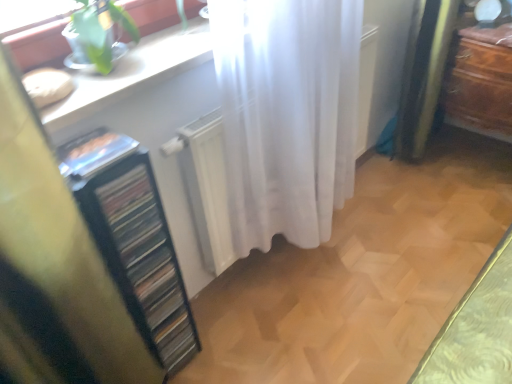
What do you see at coordinates (133, 73) in the screenshot? I see `white glossy counter top at upper left` at bounding box center [133, 73].

The image size is (512, 384). What do you see at coordinates (287, 114) in the screenshot?
I see `white sheer curtain at center` at bounding box center [287, 114].

Image resolution: width=512 pixels, height=384 pixels. Describe the element at coordinates (482, 82) in the screenshot. I see `brown wooden dresser at right` at that location.

The height and width of the screenshot is (384, 512). I want to click on black plastic file cabinet at left, so click(x=133, y=239).

Could you tell me if white sheer curtain at center is facing black plastic file cabinet at left?

No, white sheer curtain at center is not facing towards black plastic file cabinet at left.

Does white sheer curtain at center appear on the right side of black plastic file cabinet at left?

Indeed, white sheer curtain at center is positioned on the right side of black plastic file cabinet at left.

Does white sheer curtain at center have a lesser height compared to black plastic file cabinet at left?

Correct, white sheer curtain at center is not as tall as black plastic file cabinet at left.

Is the position of white sheer curtain at center less distant than that of black plastic file cabinet at left?

No, white sheer curtain at center is behind black plastic file cabinet at left.

Is white sheer curtain at center aimed at white glossy counter top at upper left?

No, white sheer curtain at center is not facing towards white glossy counter top at upper left.

This screenshot has height=384, width=512. What are the coordinates of `counter top above the white sheer curtain at center (from a real-world perspective)` in the screenshot? It's located at (133, 73).

Is point (294, 228) positioned in front of point (136, 83)?

No.

What's the angular difference between white sheer curtain at center and white glossy counter top at upper left's facing directions?

The angular difference between white sheer curtain at center and white glossy counter top at upper left is 0.134 degrees.

From a real-world perspective, which object rests below the other?

brown wooden dresser at right, from a real-world perspective.

Considering the relative sizes of brown wooden dresser at right and black plastic file cabinet at left in the image provided, is brown wooden dresser at right wider than black plastic file cabinet at left?

Indeed, brown wooden dresser at right has a greater width compared to black plastic file cabinet at left.

Based on the photo, from the image's perspective, which is above, brown wooden dresser at right or black plastic file cabinet at left?

brown wooden dresser at right.

Is brown wooden dresser at right facing towards black plastic file cabinet at left?

Yes, brown wooden dresser at right is oriented towards black plastic file cabinet at left.

Does black plastic file cabinet at left have a smaller size compared to white sheer curtain at center?

Indeed, black plastic file cabinet at left has a smaller size compared to white sheer curtain at center.

Considering the relative sizes of black plastic file cabinet at left and white sheer curtain at center in the image provided, is black plastic file cabinet at left shorter than white sheer curtain at center?

In fact, black plastic file cabinet at left may be taller than white sheer curtain at center.

Considering the positions of points (133, 152) and (351, 98), is point (133, 152) closer to camera compared to point (351, 98)?

Yes, point (133, 152) is in front of point (351, 98).

Is black plastic file cabinet at left directly adjacent to white sheer curtain at center?

No, black plastic file cabinet at left is not with white sheer curtain at center.

Is brown wooden dresser at right spatially inside white sheer curtain at center, or outside of it?

brown wooden dresser at right is spatially situated outside white sheer curtain at center.

Is brown wooden dresser at right not close to white sheer curtain at center?

brown wooden dresser at right is actually quite close to white sheer curtain at center.

Find the location of a particular element. furniture lying on the right of white sheer curtain at center is located at coordinates (482, 82).

Can you confirm if brown wooden dresser at right is taller than white sheer curtain at center?

Yes.

From the picture: Considering their positions, is white glossy counter top at upper left located in front of or behind white sheer curtain at center?

Visually, white glossy counter top at upper left is located in front of white sheer curtain at center.

Looking at their sizes, would you say white glossy counter top at upper left is wider or thinner than white sheer curtain at center?

Clearly, white glossy counter top at upper left has more width compared to white sheer curtain at center.

Can we say white glossy counter top at upper left lies outside white sheer curtain at center?

white glossy counter top at upper left is positioned outside white sheer curtain at center.

Is white glossy counter top at upper left facing away from white sheer curtain at center?

white glossy counter top at upper left is not turned away from white sheer curtain at center.

From the image's perspective, is white glossy counter top at upper left beneath brown wooden dresser at right?

Correct, white glossy counter top at upper left appears lower than brown wooden dresser at right in the image.

Is white glossy counter top at upper left facing towards brown wooden dresser at right?

No.

Considering the sizes of objects white glossy counter top at upper left and brown wooden dresser at right in the image provided, who is wider, white glossy counter top at upper left or brown wooden dresser at right?

With larger width is brown wooden dresser at right.

Locate an element on the screen. The width and height of the screenshot is (512, 384). file cabinet positioned vertically above the white sheer curtain at center (from a real-world perspective) is located at coordinates (133, 239).

Locate an element on the screen. The width and height of the screenshot is (512, 384). curtain on the right of white glossy counter top at upper left is located at coordinates point(287,114).

Based on their spatial positions, is brown wooden dresser at right or white glossy counter top at upper left further from white sheer curtain at center?

brown wooden dresser at right is positioned further to the anchor white sheer curtain at center.

From the image, which object appears to be nearer to white glossy counter top at upper left, white sheer curtain at center or brown wooden dresser at right?

The object closer to white glossy counter top at upper left is white sheer curtain at center.

Looking at the image, which one is located closer to brown wooden dresser at right, white glossy counter top at upper left or white sheer curtain at center?

Result: Among the two, white sheer curtain at center is located nearer to brown wooden dresser at right.

Which object lies further to the anchor point brown wooden dresser at right, black plastic file cabinet at left or white sheer curtain at center?

black plastic file cabinet at left is further to brown wooden dresser at right.

Considering their positions, is white sheer curtain at center positioned closer to white glossy counter top at upper left than black plastic file cabinet at left?

black plastic file cabinet at left lies closer to white glossy counter top at upper left than the other object.

Looking at the image, which one is located further to black plastic file cabinet at left, brown wooden dresser at right or white glossy counter top at upper left?

Among the two, brown wooden dresser at right is located further to black plastic file cabinet at left.

Which object lies nearer to the anchor point white glossy counter top at upper left, brown wooden dresser at right or black plastic file cabinet at left?

Based on the image, black plastic file cabinet at left appears to be nearer to white glossy counter top at upper left.

From the image, which object appears to be farther from black plastic file cabinet at left, white sheer curtain at center or brown wooden dresser at right?

brown wooden dresser at right is positioned further to the anchor black plastic file cabinet at left.

The width and height of the screenshot is (512, 384). Find the location of `curtain located between black plastic file cabinet at left and brown wooden dresser at right in the left-right direction`. curtain located between black plastic file cabinet at left and brown wooden dresser at right in the left-right direction is located at coordinates coord(287,114).

This screenshot has width=512, height=384. I want to click on counter top between black plastic file cabinet at left and brown wooden dresser at right, so click(133, 73).

You are a GUI agent. You are given a task and a screenshot of the screen. Output one action in this format:
    pyautogui.click(x=<x>, y=<y>)
    Task: Click on the curtain between white glossy counter top at upper left and black plastic file cabinet at left in the vertical direction
    
    Given the screenshot: What is the action you would take?
    pyautogui.click(x=287, y=114)

The height and width of the screenshot is (384, 512). In order to click on curtain located between white glossy counter top at upper left and brown wooden dresser at right in the left-right direction in this screenshot , I will do `click(287, 114)`.